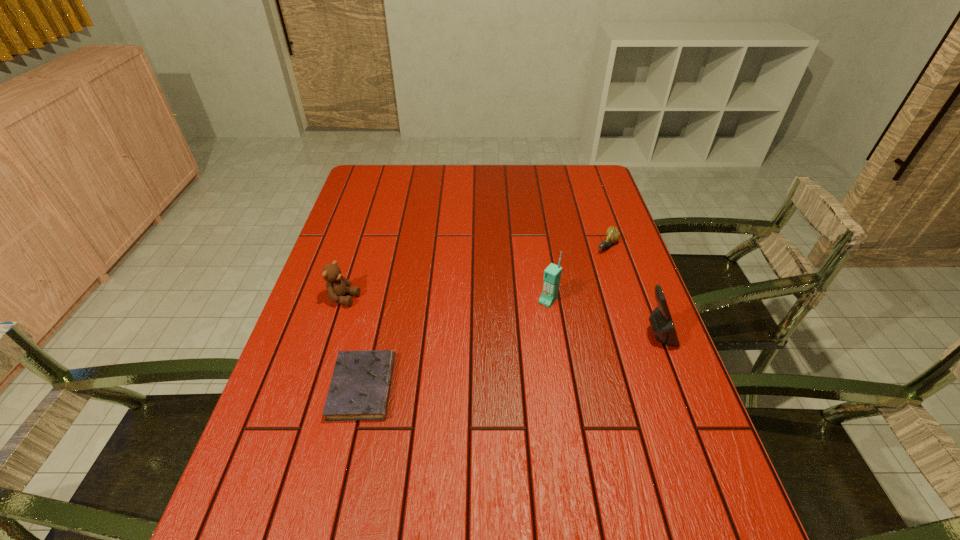
The image size is (960, 540). Find the location of `vacant space on the desktop that is between the diary and the right cellular telephone and is positioned on the front-facing side of the escargot`. vacant space on the desktop that is between the diary and the right cellular telephone and is positioned on the front-facing side of the escargot is located at coordinates (486, 366).

This screenshot has height=540, width=960. What are the coordinates of `vacant spot on the desktop that is between the nearest object and the nearer cellular telephone and is positioned on the keypad of the farther cellular telephone` in the screenshot? It's located at (494, 364).

Find the location of a particular element. This screenshot has height=540, width=960. vacant space on the desktop that is between the diary and the second nearest object and is positioned on the face of the teddy bear is located at coordinates (540, 356).